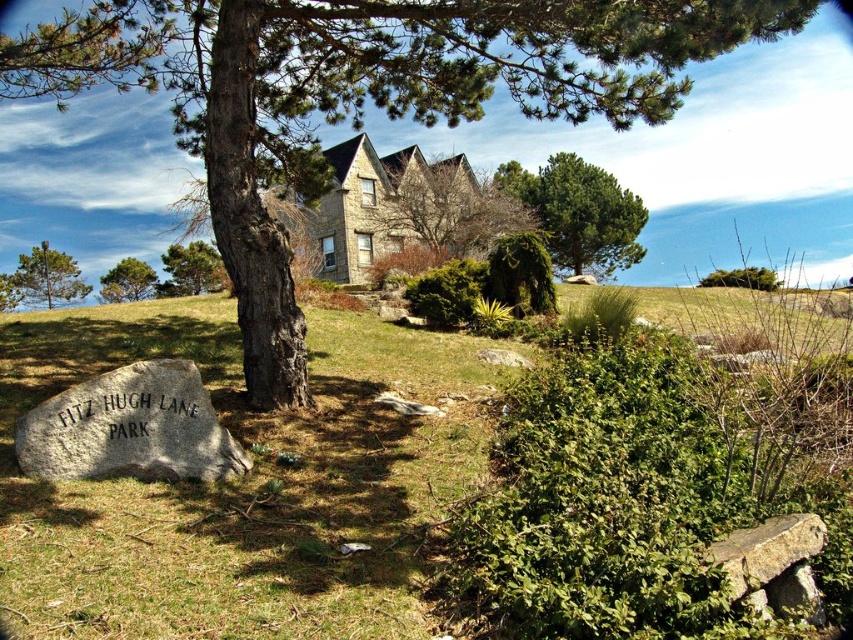
Question: Estimate the real-world distances between objects in this image. Which object is closer to the green textured tree at center?

Choices:
 (A) green grassy at lower left
 (B) green leafy bush at upper right
 (C) green leafy tree at upper left
 (D) brown stone house at upper center

Answer: (A)

Question: Is brown stone house at upper center above green rough bark tree at upper center?

Choices:
 (A) yes
 (B) no

Answer: (A)

Question: Estimate the real-world distances between objects in this image. Which object is closer to the green leafy tree at upper center?

Choices:
 (A) green rough bark tree at upper center
 (B) green matte tree at upper left
 (C) green leafy bush at upper right

Answer: (C)

Question: Among these points, which one is nearest to the camera?

Choices:
 (A) (727, 284)
 (B) (216, 563)

Answer: (B)

Question: In this image, where is green leafy tree at upper center located relative to brown stone house at upper center?

Choices:
 (A) left
 (B) right

Answer: (B)

Question: Does green matte tree at upper left appear under green leafy bush at upper right?

Choices:
 (A) no
 (B) yes

Answer: (B)